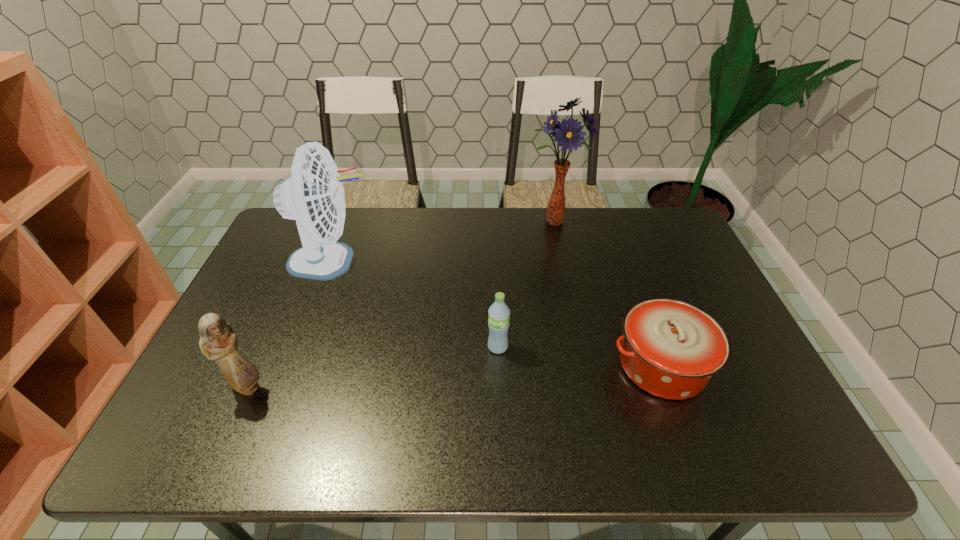
Find the location of a particular element. flower arrangement is located at coordinates (568, 134).

Locate an element on the screen. fan is located at coordinates (314, 196).

Locate an element on the screen. the third tallest object is located at coordinates (218, 341).

I want to click on the second shortest object, so click(x=499, y=313).

The image size is (960, 540). Find the location of `water bottle`. water bottle is located at coordinates (499, 313).

The image size is (960, 540). I want to click on casserole, so click(671, 348).

Where is `vacant region located on the front of the farthest object`? vacant region located on the front of the farthest object is located at coordinates [x=571, y=303].

Find the location of a particular element. The image size is (960, 540). blank space located 0.330m on the grille of the fan is located at coordinates (478, 261).

At what (x,y) coordinates should I click in order to perform the action: click on vacant space located 0.180m on the front-facing side of the figurine. Please return your answer as a coordinate pair (x, y). The width and height of the screenshot is (960, 540). Looking at the image, I should click on tap(341, 387).

Where is `free spot located 0.150m on the left of the second shortest object`? The height and width of the screenshot is (540, 960). free spot located 0.150m on the left of the second shortest object is located at coordinates (x=430, y=347).